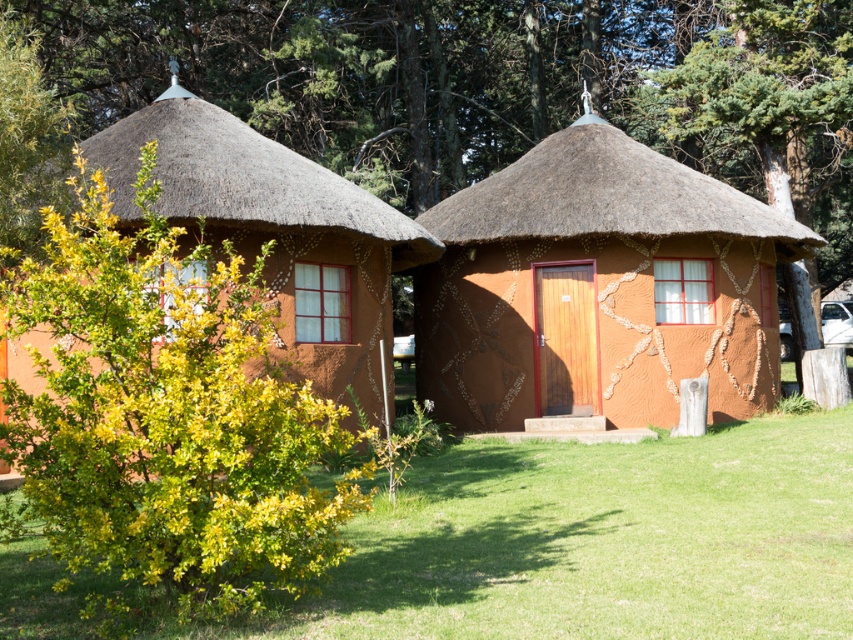
You are planning to install a new garden light that requires being placed under the tallest object in the scene. Given the green leafy bush at center and the matte clay hut at left, which one should you choose to place the light under?

The green leafy bush at center has a greater height compared to the matte clay hut at left, so you should place the light under the green leafy bush at center.

You are standing in front of the green leafy bush at center and want to enter the matte clay hut at left. What should you do first?

You should move backward away from the green leafy bush at center to reach the matte clay hut at left since the bush is blocking the path to the hut.